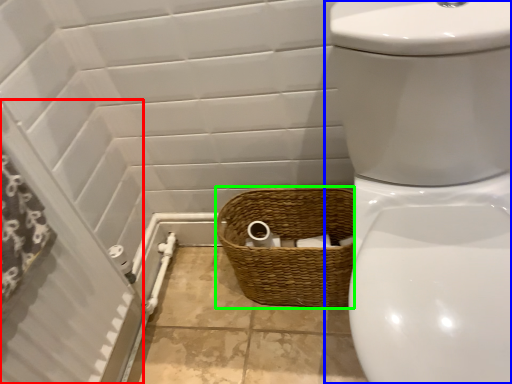
Question: Which object is the closest to the screen door (highlighted by a red box)? Choose among these: toilet (highlighted by a blue box) or basket (highlighted by a green box).

Choices:
 (A) toilet
 (B) basket

Answer: (B)